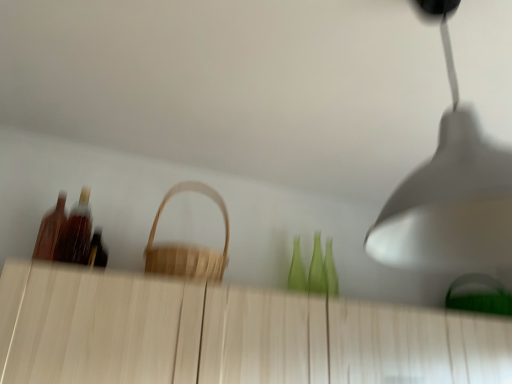
What do you see at coordinates (51, 230) in the screenshot?
I see `wooden bottle at left, acting as the first bottle starting from the left` at bounding box center [51, 230].

Measure the distance between shiny brown bottle at left, the first bottle from the right, and camera.

A distance of 1.53 meters exists between shiny brown bottle at left, the first bottle from the right, and camera.

Find the location of `shiny brown bottle at left, acting as the second bottle starting from the left`. shiny brown bottle at left, acting as the second bottle starting from the left is located at coordinates (78, 231).

In order to face natural wood basket at center, should I rotate leftwards or rightwards?

You should look left and rotate roughly 8.814 degrees.

Consider the image. What is the approximate height of white matte lampshade at upper right?

The height of white matte lampshade at upper right is 25.21 inches.

Locate an element on the screen. This screenshot has height=384, width=512. wooden bottle at left, acting as the first bottle starting from the left is located at coordinates (51, 230).

Are natural wood basket at center and wooden bottle at left, the second bottle from the right, far apart?

That's not correct — natural wood basket at center is a little close to wooden bottle at left, the second bottle from the right.

Which is in front, natural wood basket at center or wooden bottle at left, the second bottle from the right?

natural wood basket at center.

Is natural wood basket at center facing away from wooden bottle at left, the second bottle from the right?

That's not correct — natural wood basket at center is not looking away from wooden bottle at left, the second bottle from the right.

Where is `bottle located above the wooden bottle at left, acting as the first bottle starting from the left (from a real-world perspective)`? This screenshot has width=512, height=384. bottle located above the wooden bottle at left, acting as the first bottle starting from the left (from a real-world perspective) is located at coordinates (78, 231).

Is wooden bottle at left, acting as the first bottle starting from the left, positioned beyond the bounds of shiny brown bottle at left, the first bottle from the right?

Yes.

Considering the positions of objects wooden bottle at left, the second bottle from the right, and shiny brown bottle at left, acting as the second bottle starting from the left, in the image provided, who is in front, wooden bottle at left, the second bottle from the right, or shiny brown bottle at left, acting as the second bottle starting from the left,?

wooden bottle at left, the second bottle from the right, is closer to the camera.

From the image's perspective, is wooden bottle at left, the second bottle from the right, over shiny brown bottle at left, the first bottle from the right?

Yes.

The image size is (512, 384). Find the location of `bottle that is the 1st one when counting backward from the light wood dresser at center`. bottle that is the 1st one when counting backward from the light wood dresser at center is located at coordinates (51, 230).

In the scene shown: Relative to wooden bottle at left, the second bottle from the right, is light wood dresser at center in front or behind?

Visually, light wood dresser at center is located in front of wooden bottle at left, the second bottle from the right.

Based on the photo, considering the sizes of light wood dresser at center and wooden bottle at left, the second bottle from the right, in the image, is light wood dresser at center wider or thinner than wooden bottle at left, the second bottle from the right,?

Clearly, light wood dresser at center has more width compared to wooden bottle at left, the second bottle from the right.

Which object is positioned more to the left, light wood dresser at center or wooden bottle at left, the second bottle from the right?

wooden bottle at left, the second bottle from the right.

You are a GUI agent. You are given a task and a screenshot of the screen. Output one action in this format:
    pyautogui.click(x=<x>, y=<y>)
    Task: Click on the basket located on the left of light wood dresser at center
    Image resolution: width=512 pixels, height=384 pixels.
    Given the screenshot: What is the action you would take?
    pyautogui.click(x=188, y=245)

Which object is thinner, light wood dresser at center or natural wood basket at center?

Thinner between the two is natural wood basket at center.

Is light wood dresser at center touching natural wood basket at center?

They are not placed beside each other.

From the image's perspective, is light wood dresser at center located above or below natural wood basket at center?

Based on their image positions, light wood dresser at center is located beneath natural wood basket at center.

Which is in front, point (479, 184) or point (80, 254)?

The point (479, 184) is closer to the camera.

Which bottle is the 1st one when counting from the left side of the white matte lampshade at upper right? Please provide its 2D coordinates.

[(78, 231)]

Is white matte lampshade at upper right directly adjacent to shiny brown bottle at left, acting as the second bottle starting from the left?

No, white matte lampshade at upper right is not next to shiny brown bottle at left, acting as the second bottle starting from the left.

Looking at this image, considering the sizes of shiny brown bottle at left, acting as the second bottle starting from the left, and wooden bottle at left, the second bottle from the right, in the image, is shiny brown bottle at left, acting as the second bottle starting from the left, wider or thinner than wooden bottle at left, the second bottle from the right,?

shiny brown bottle at left, acting as the second bottle starting from the left, is wider than wooden bottle at left, the second bottle from the right.

From a real-world perspective, who is located lower, shiny brown bottle at left, acting as the second bottle starting from the left, or wooden bottle at left, the second bottle from the right?

wooden bottle at left, the second bottle from the right.

Image resolution: width=512 pixels, height=384 pixels. I want to click on bottle positioned vertically above the wooden bottle at left, the second bottle from the right (from a real-world perspective), so click(78, 231).

How much distance is there between shiny brown bottle at left, the first bottle from the right, and wooden bottle at left, acting as the first bottle starting from the left?

They are 6.75 centimeters apart.

From the image's perspective, which is below, natural wood basket at center or light wood dresser at center?

light wood dresser at center, from the image's perspective.

I want to click on dresser that appears below the natural wood basket at center (from the image's perspective), so click(228, 334).

From a real-world perspective, is natural wood basket at center below light wood dresser at center?

No, from a real-world perspective, natural wood basket at center is not beneath light wood dresser at center.

This screenshot has height=384, width=512. I want to click on the 2nd bottle above when counting from the natural wood basket at center (from the image's perspective), so click(51, 230).

What are the coordinates of `bottle below the wooden bottle at left, the second bottle from the right (from the image's perspective)` in the screenshot? It's located at (78, 231).

Looking at the image, which one is located further to natural wood basket at center, shiny brown bottle at left, the first bottle from the right, or wooden bottle at left, the second bottle from the right?

wooden bottle at left, the second bottle from the right, lies further to natural wood basket at center than the other object.

Based on their spatial positions, is white matte lampshade at upper right or wooden bottle at left, the second bottle from the right, further from shiny brown bottle at left, acting as the second bottle starting from the left?

white matte lampshade at upper right is further to shiny brown bottle at left, acting as the second bottle starting from the left.

Looking at the image, which one is located further to light wood dresser at center, white matte lampshade at upper right or shiny brown bottle at left, the first bottle from the right?

Among the two, white matte lampshade at upper right is located further to light wood dresser at center.

Looking at the image, which one is located further to shiny brown bottle at left, the first bottle from the right, light wood dresser at center or wooden bottle at left, acting as the first bottle starting from the left?

light wood dresser at center is positioned further to the anchor shiny brown bottle at left, the first bottle from the right.

From the image, which object appears to be nearer to wooden bottle at left, acting as the first bottle starting from the left, shiny brown bottle at left, acting as the second bottle starting from the left, or white matte lampshade at upper right?

shiny brown bottle at left, acting as the second bottle starting from the left, is positioned closer to the anchor wooden bottle at left, acting as the first bottle starting from the left.

From the picture: From the image, which object appears to be nearer to light wood dresser at center, wooden bottle at left, acting as the first bottle starting from the left, or white matte lampshade at upper right?

wooden bottle at left, acting as the first bottle starting from the left.

When comparing their distances from white matte lampshade at upper right, does wooden bottle at left, acting as the first bottle starting from the left, or shiny brown bottle at left, the first bottle from the right, seem further?

The object further to white matte lampshade at upper right is wooden bottle at left, acting as the first bottle starting from the left.

Based on their spatial positions, is light wood dresser at center or shiny brown bottle at left, the first bottle from the right, further from white matte lampshade at upper right?

Among the two, shiny brown bottle at left, the first bottle from the right, is located further to white matte lampshade at upper right.

Where is `bottle between wooden bottle at left, the second bottle from the right, and white matte lampshade at upper right`? Image resolution: width=512 pixels, height=384 pixels. bottle between wooden bottle at left, the second bottle from the right, and white matte lampshade at upper right is located at coordinates (78, 231).

Where is `basket between shiny brown bottle at left, the first bottle from the right, and light wood dresser at center, in the horizontal direction`? The height and width of the screenshot is (384, 512). basket between shiny brown bottle at left, the first bottle from the right, and light wood dresser at center, in the horizontal direction is located at coordinates (188, 245).

This screenshot has height=384, width=512. I want to click on basket between wooden bottle at left, acting as the first bottle starting from the left, and light wood dresser at center, in the horizontal direction, so [188, 245].

Locate an element on the screen. dresser between white matte lampshade at upper right and natural wood basket at center in the front-back direction is located at coordinates (228, 334).